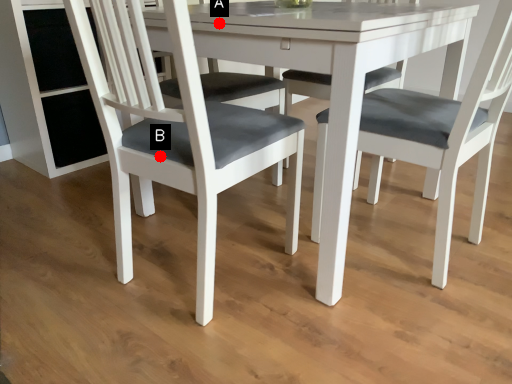
Question: Two points are circled on the image, labeled by A and B beside each circle. Which point is closer to the camera taking this photo?

Choices:
 (A) A is closer
 (B) B is closer

Answer: (B)